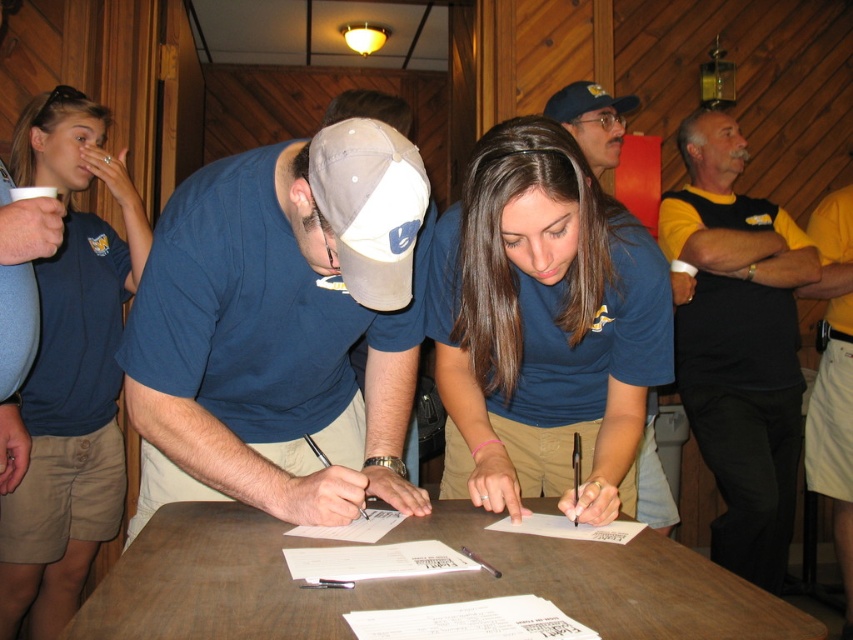
Is point (370, 132) farther from viewer compared to point (585, 97)?

No, (370, 132) is in front of (585, 97).

Is gray fabric baseball cap at center shorter than blue t-shirt at center?

Correct, gray fabric baseball cap at center is not as tall as blue t-shirt at center.

You are a GUI agent. You are given a task and a screenshot of the screen. Output one action in this format:
    pyautogui.click(x=<x>, y=<y>)
    Task: Click on the gray fabric baseball cap at center
    The image size is (853, 640).
    Given the screenshot: What is the action you would take?
    pyautogui.click(x=370, y=205)

Find the location of a particular element. This screenshot has height=640, width=853. gray fabric baseball cap at center is located at coordinates (370, 205).

Does brown wooden table at center have a smaller size compared to blue cotton shirt at upper left?

Indeed, brown wooden table at center has a smaller size compared to blue cotton shirt at upper left.

The height and width of the screenshot is (640, 853). I want to click on brown wooden table at center, so click(413, 582).

You are a GUI agent. You are given a task and a screenshot of the screen. Output one action in this format:
    pyautogui.click(x=<x>, y=<y>)
    Task: Click on the brown wooden table at center
    This screenshot has height=640, width=853.
    Given the screenshot: What is the action you would take?
    pyautogui.click(x=413, y=582)

Does blue fabric shirt at center have a lesser width compared to white paper at center?

Incorrect, blue fabric shirt at center's width is not less than white paper at center's.

Does point (343, 145) come farther from viewer compared to point (437, 557)?

No, it is not.

At what (x,y) coordinates should I click in order to perform the action: click on blue fabric shirt at center. Please return your answer as a coordinate pair (x, y). Looking at the image, I should click on (282, 326).